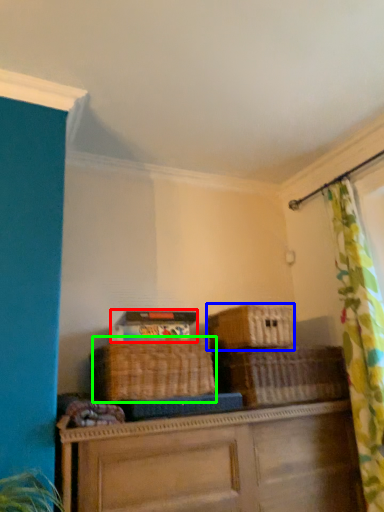
Question: Based on their relative distances, which object is farther from storage box (highlighted by a red box)? Choose from basket (highlighted by a blue box) and basket (highlighted by a green box).

Choices:
 (A) basket
 (B) basket

Answer: (A)